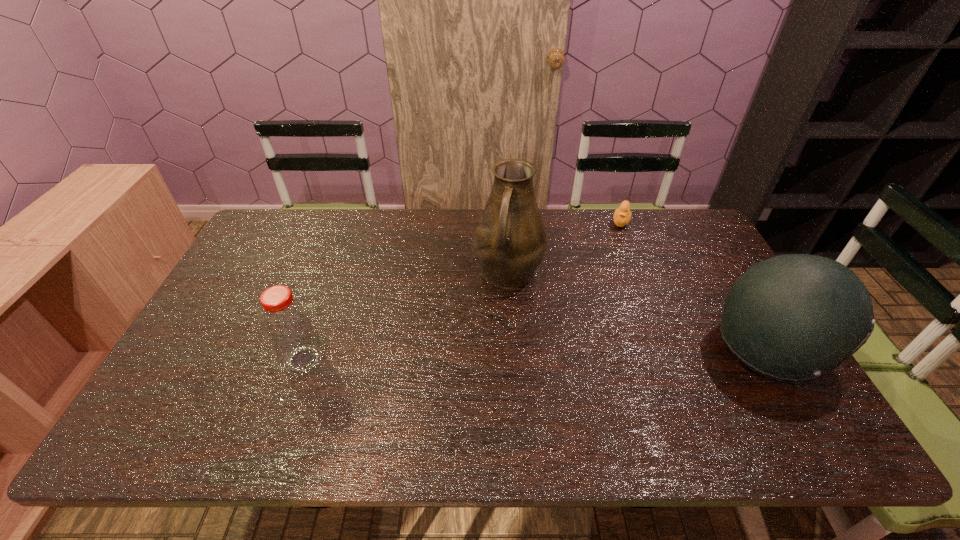
Locate an element on the screen. The image size is (960, 540). free space between the second shortest object and the farthest object is located at coordinates (462, 291).

Locate an element on the screen. The height and width of the screenshot is (540, 960). vacant space in between the third object from right to left and the rightmost object is located at coordinates (638, 311).

Identify the location of vacant area that lies between the pitcher and the bottle. The height and width of the screenshot is (540, 960). [406, 317].

The height and width of the screenshot is (540, 960). I want to click on vacant space that is in between the second shortest object and the farthest object, so click(x=462, y=291).

Where is `vacant region between the rightmost object and the third object from right to left`? This screenshot has width=960, height=540. vacant region between the rightmost object and the third object from right to left is located at coordinates (638, 311).

Identify which object is the second nearest to the third tallest object. Please provide its 2D coordinates. Your answer should be formatted as a tuple, i.e. [(x, y)], where the tuple contains the x and y coordinates of a point satisfying the conditions above.

[(622, 215)]

Select which object appears as the third closest to the second object from right to left. Please provide its 2D coordinates. Your answer should be formatted as a tuple, i.e. [(x, y)], where the tuple contains the x and y coordinates of a point satisfying the conditions above.

[(287, 324)]

Where is `blank space that satisfies the following two spatial constraints: 1. on the back side of the leftmost object; 2. at the face opening of the second tallest object`? blank space that satisfies the following two spatial constraints: 1. on the back side of the leftmost object; 2. at the face opening of the second tallest object is located at coordinates (307, 349).

This screenshot has height=540, width=960. I want to click on vacant space that satisfies the following two spatial constraints: 1. on the back side of the shortest object; 2. on the left side of the leftmost object, so click(353, 221).

Find the location of a particular element. vacant region that satisfies the following two spatial constraints: 1. on the back side of the bottle; 2. on the right side of the duckling is located at coordinates (353, 221).